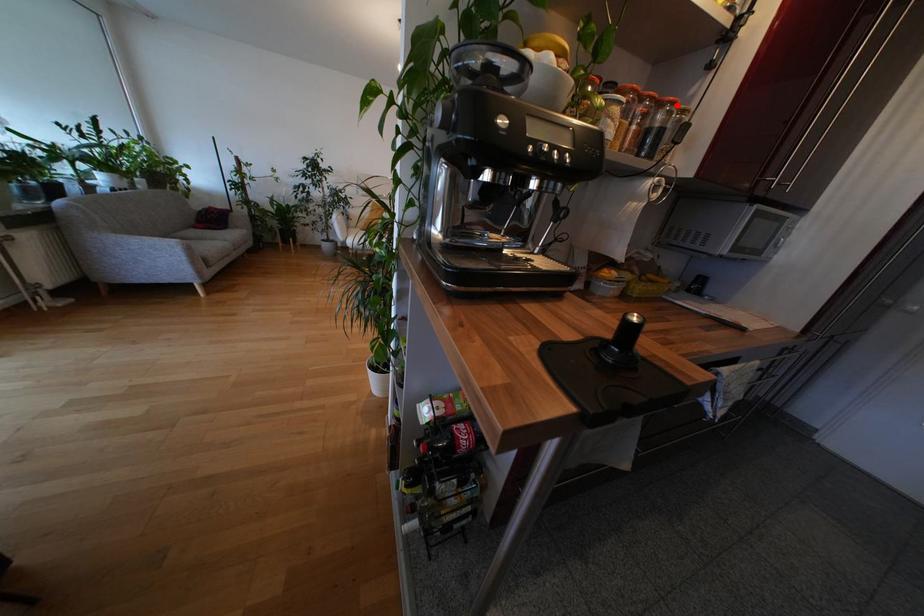
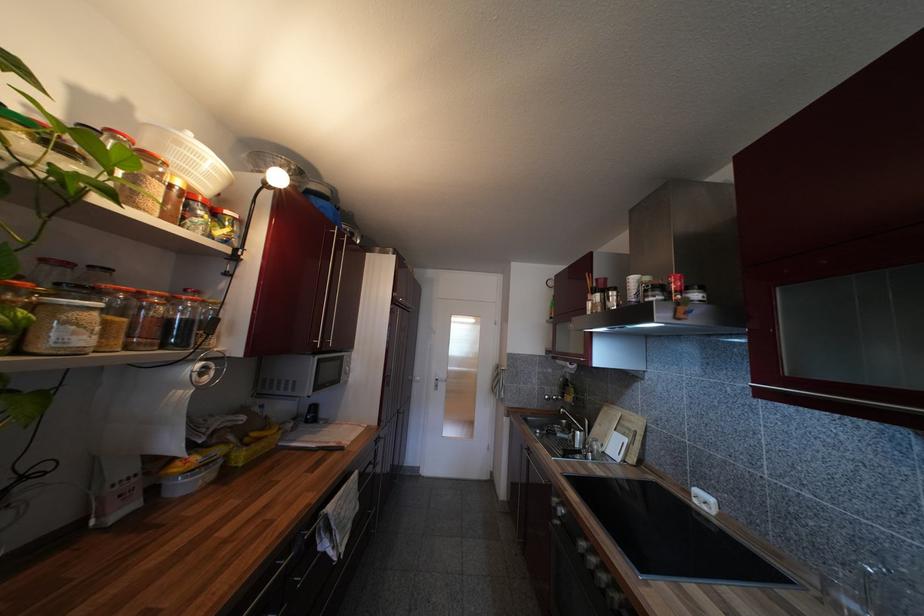
Find the pixel in the second image that matches the highlighted location in the first image.

(198, 302)